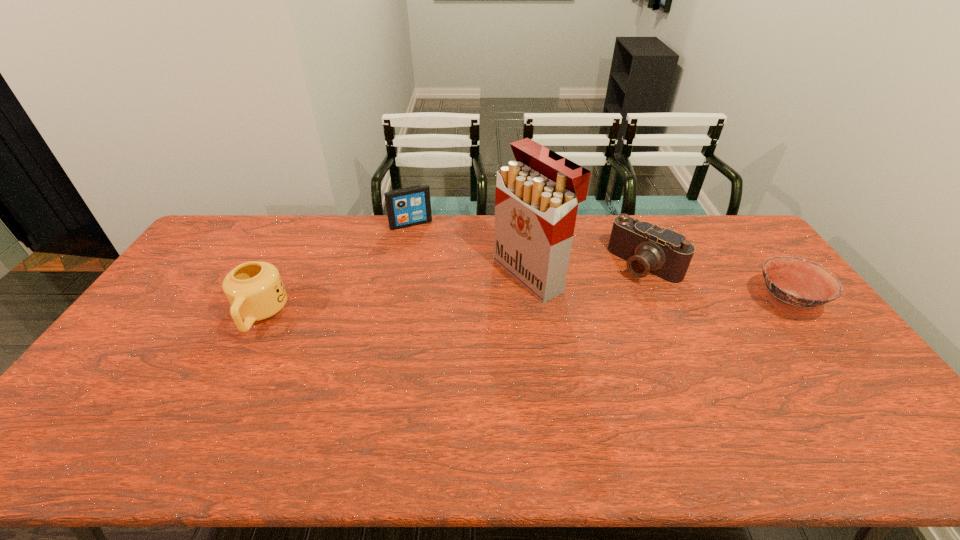
Find the location of a particular element. mug is located at coordinates (255, 291).

This screenshot has width=960, height=540. Find the location of `bowl`. bowl is located at coordinates (794, 285).

You are a GUI agent. You are given a task and a screenshot of the screen. Output one action in this format:
    pyautogui.click(x=<x>, y=<y>)
    Task: Click on the shortest object
    
    Given the screenshot: What is the action you would take?
    pyautogui.click(x=794, y=285)

You are a GUI agent. You are given a task and a screenshot of the screen. Output one action in this format:
    pyautogui.click(x=<x>, y=<y>)
    Task: Click on the fourth object from left to right
    This screenshot has height=540, width=960.
    Given the screenshot: What is the action you would take?
    pyautogui.click(x=647, y=248)

At what (x,y) coordinates should I click in order to perform the action: click on the tallest object. Please return your answer as a coordinate pair (x, y). This screenshot has height=540, width=960. Looking at the image, I should click on (536, 200).

Identify the location of cigarette case. (536, 200).

You are a GUI agent. You are given a task and a screenshot of the screen. Output one action in this format:
    pyautogui.click(x=<x>, y=<y>)
    Task: Click on the fourth object from right to left
    
    Given the screenshot: What is the action you would take?
    pyautogui.click(x=410, y=206)

You are a GUI agent. You are given a task and a screenshot of the screen. Output one action in this format:
    pyautogui.click(x=<x>, y=<y>)
    Task: Click on the iPod
    
    Given the screenshot: What is the action you would take?
    pyautogui.click(x=410, y=206)

This screenshot has height=540, width=960. What are the coordinates of `free space located 0.050m on the handle side of the mug` in the screenshot? It's located at (239, 355).

The width and height of the screenshot is (960, 540). I want to click on free spot located 0.100m on the front of the shortest object, so click(825, 355).